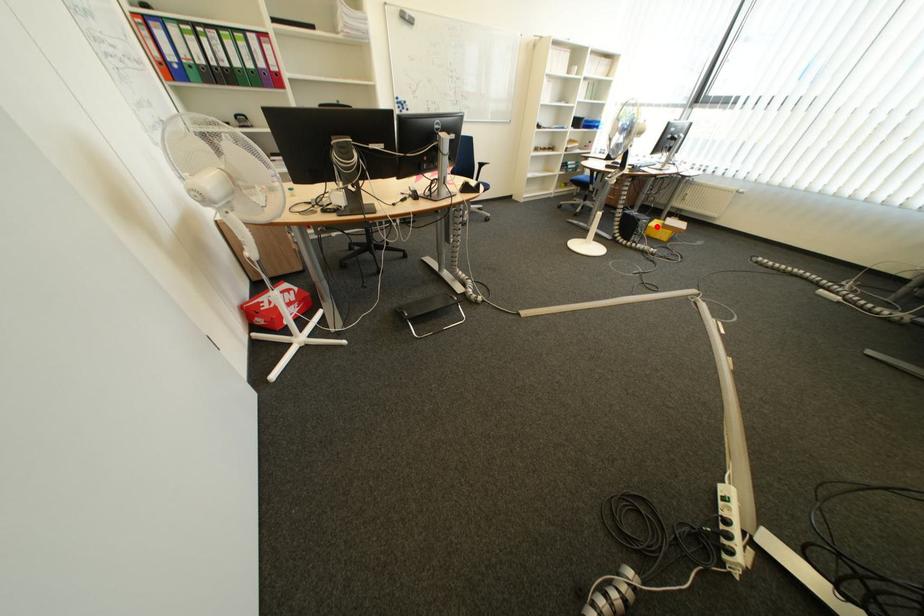
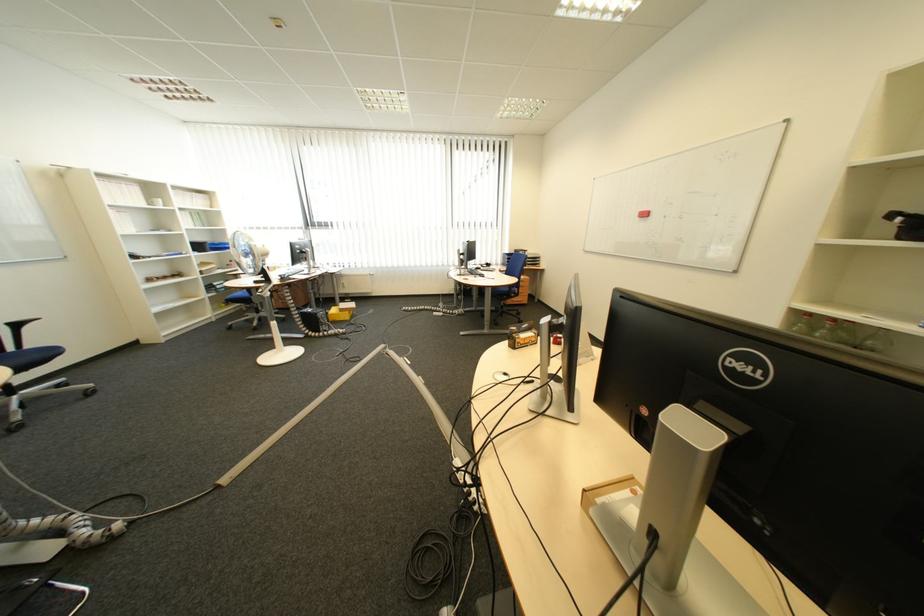
The point at the highlighted location is marked in the first image. Where is the corresponding point in the second image?

(335, 317)